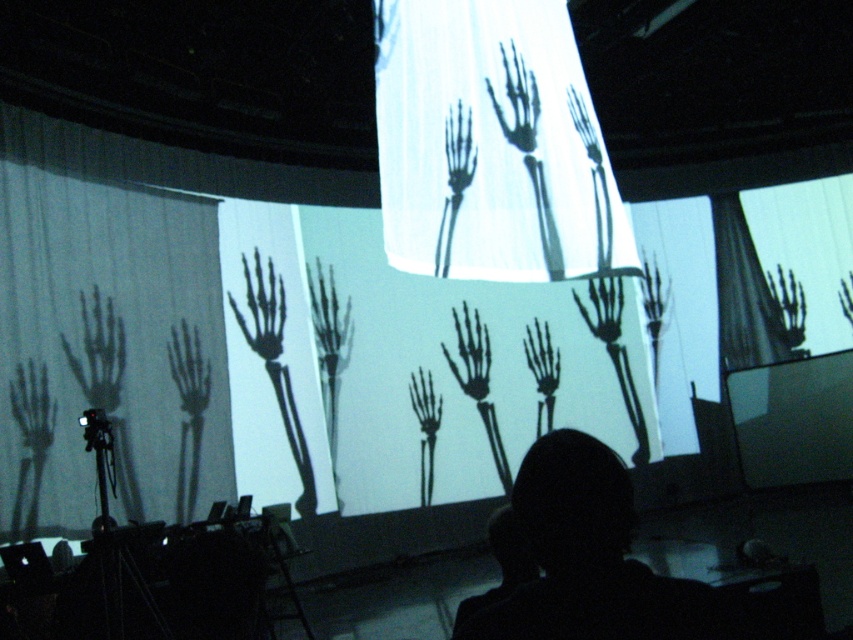
What do you see at coordinates (454, 179) in the screenshot? I see `transparent bone-like hand at center` at bounding box center [454, 179].

Is transparent bone-like hand at center to the right of transparent plastic skeleton hand at upper center from the viewer's perspective?

Incorrect, transparent bone-like hand at center is not on the right side of transparent plastic skeleton hand at upper center.

The image size is (853, 640). What do you see at coordinates (454, 179) in the screenshot?
I see `transparent bone-like hand at center` at bounding box center [454, 179].

I want to click on transparent bone-like hand at center, so (x=454, y=179).

Is point (88, 634) behind point (450, 163)?

No, (88, 634) is in front of (450, 163).

Can you confirm if black matte tripod at lower left is thinner than transparent bone-like hand at center?

No.

The image size is (853, 640). What do you see at coordinates (114, 586) in the screenshot? I see `black matte tripod at lower left` at bounding box center [114, 586].

What are the coordinates of `black matte tripod at lower left` in the screenshot? It's located at (114, 586).

Who is more forward, (x=606, y=566) or (x=608, y=244)?

Point (x=606, y=566) is more forward.

What do you see at coordinates (587, 557) in the screenshot? I see `black hair at lower center` at bounding box center [587, 557].

In order to click on black hair at lower center in this screenshot , I will do `click(587, 557)`.